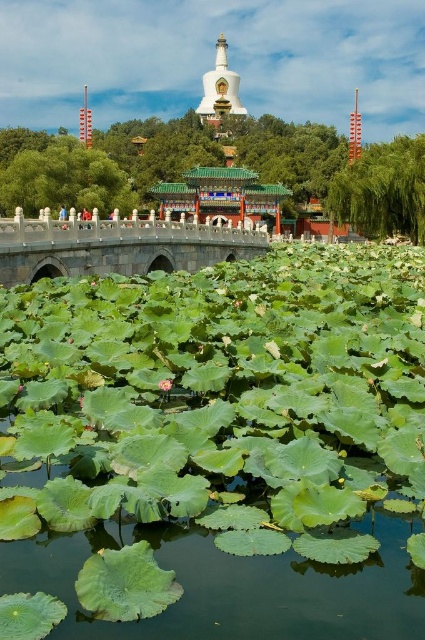
In the scene shown: You are a visitor at this pond and want to cross from one side to the other. You notice the green leafy water at center and the stone bridge at center. Which one is larger in size so you can safely walk on it?

The stone bridge at center is larger than the green leafy water at center, so you can safely walk on the stone bridge at center.

You are standing at the edge of the pond and see the point marked at coordinates [235,586]. Based on the scene description, what is the location of this point relative to the green leafy water at center?

The point at [235,586] is located on the green leafy water at center.